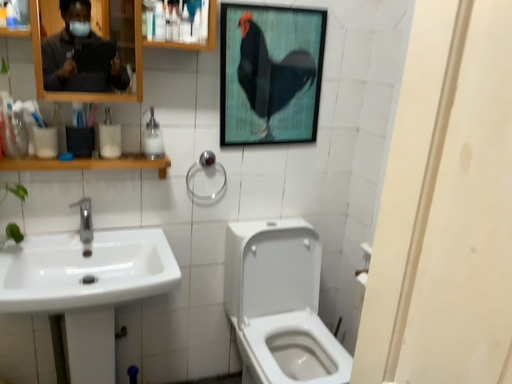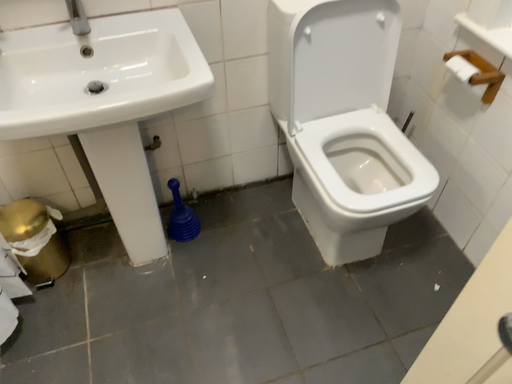
Question: Which way did the camera rotate in the video?

Choices:
 (A) rotated downward
 (B) rotated upward

Answer: (A)